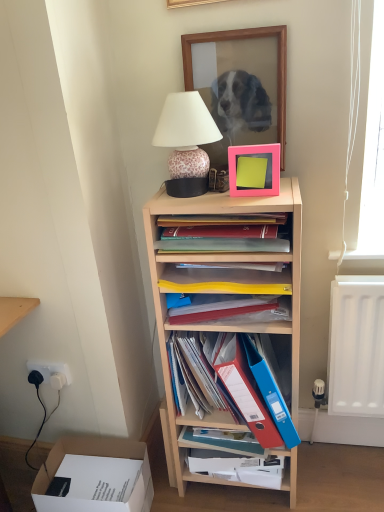
What do you see at coordinates (230, 309) in the screenshot? The width and height of the screenshot is (384, 512). I see `yellow plastic folder at center, the 2th book when ordered from top to bottom` at bounding box center [230, 309].

What is the approximate height of wooden picture frame at upper center, the 2th picture frame in the front-to-back sequence?

It is 15.94 inches.

At what (x,y) coordinates should I click in order to perform the action: click on matte plastic books at upper center, the 3th book when ordered from bottom to top. Please return your answer as a coordinate pair (x, y). Image resolution: width=384 pixels, height=512 pixels. Looking at the image, I should click on (224, 234).

You are a GUI agent. You are given a task and a screenshot of the screen. Output one action in this format:
    pyautogui.click(x=<x>, y=<y>)
    Task: Click on the white cardboard box at lower left
    
    Given the screenshot: What is the action you would take?
    pyautogui.click(x=94, y=476)

Find the location of `white plastic electric outlet at lower left`. white plastic electric outlet at lower left is located at coordinates (52, 372).

Where is `yellow plastic folder at center, the 2th book when ordered from top to bottom`? The width and height of the screenshot is (384, 512). yellow plastic folder at center, the 2th book when ordered from top to bottom is located at coordinates (230, 309).

From the image's perspective, is wooden picture frame at upper center, the 2th picture frame in the front-to-back sequence, below matte pink picture frame at upper center, acting as the 1th picture frame starting from the bottom?

No, from the image's perspective, wooden picture frame at upper center, the 2th picture frame in the front-to-back sequence, is not below matte pink picture frame at upper center, acting as the 1th picture frame starting from the bottom.

Is wooden picture frame at upper center, the 2th picture frame in the bottom-to-top sequence, not near matte pink picture frame at upper center, the first picture frame when ordered from front to back?

That's not correct — wooden picture frame at upper center, the 2th picture frame in the bottom-to-top sequence, is a little close to matte pink picture frame at upper center, the first picture frame when ordered from front to back.

How different are the orientations of wooden picture frame at upper center, the 2th picture frame in the front-to-back sequence, and matte pink picture frame at upper center, the first picture frame when ordered from front to back, in degrees?

2.08 degrees.

Considering the sizes of wooden picture frame at upper center, the 2th picture frame in the front-to-back sequence, and matte pink picture frame at upper center, the first picture frame when ordered from front to back, in the image, is wooden picture frame at upper center, the 2th picture frame in the front-to-back sequence, wider or thinner than matte pink picture frame at upper center, the first picture frame when ordered from front to back,?

In the image, wooden picture frame at upper center, the 2th picture frame in the front-to-back sequence, appears to be more narrow than matte pink picture frame at upper center, the first picture frame when ordered from front to back.

Is wooden picture frame at upper center, the first picture frame when ordered from top to bottom, inside the boundaries of blue plastic folder at center, the first book positioned from the bottom, or outside?

wooden picture frame at upper center, the first picture frame when ordered from top to bottom, is located beyond the bounds of blue plastic folder at center, the first book positioned from the bottom.

Considering the sizes of objects wooden picture frame at upper center, the 2th picture frame in the front-to-back sequence, and blue plastic folder at center, the third book in the top-to-bottom sequence, in the image provided, who is thinner, wooden picture frame at upper center, the 2th picture frame in the front-to-back sequence, or blue plastic folder at center, the third book in the top-to-bottom sequence,?

Thinner between the two is wooden picture frame at upper center, the 2th picture frame in the front-to-back sequence.

Based on their positions, is wooden picture frame at upper center, the 2th picture frame in the bottom-to-top sequence, located to the left or right of blue plastic folder at center, the third book in the top-to-bottom sequence?

wooden picture frame at upper center, the 2th picture frame in the bottom-to-top sequence, is positioned on blue plastic folder at center, the third book in the top-to-bottom sequence,'s right side.

Is matte plastic books at upper center, the 3th book when ordered from bottom to top, smaller than yellow plastic folder at center, the 2th book when ordered from top to bottom?

Actually, matte plastic books at upper center, the 3th book when ordered from bottom to top, might be larger than yellow plastic folder at center, the 2th book when ordered from top to bottom.

From the image's perspective, is matte plastic books at upper center, the 3th book when ordered from bottom to top, positioned above or below yellow plastic folder at center, the 2th book when ordered from top to bottom?

From the image's perspective, matte plastic books at upper center, the 3th book when ordered from bottom to top, appears above yellow plastic folder at center, the 2th book when ordered from top to bottom.

Considering the relative sizes of matte plastic books at upper center, the first book positioned from the top, and yellow plastic folder at center, the 2th book when ordered from top to bottom, in the image provided, is matte plastic books at upper center, the first book positioned from the top, shorter than yellow plastic folder at center, the 2th book when ordered from top to bottom,?

Incorrect, the height of matte plastic books at upper center, the first book positioned from the top, does not fall short of that of yellow plastic folder at center, the 2th book when ordered from top to bottom.

Would you say matte plastic books at upper center, the first book positioned from the top, contains yellow plastic folder at center, acting as the second book starting from the bottom?

Definitely not — yellow plastic folder at center, acting as the second book starting from the bottom, is not inside matte plastic books at upper center, the first book positioned from the top.

Considering the sizes of objects white cardboard box at lower left and blue plastic folder at center, the first book positioned from the bottom, in the image provided, who is wider, white cardboard box at lower left or blue plastic folder at center, the first book positioned from the bottom,?

Wider between the two is white cardboard box at lower left.

Considering the sizes of white cardboard box at lower left and blue plastic folder at center, the third book in the top-to-bottom sequence, in the image, is white cardboard box at lower left taller or shorter than blue plastic folder at center, the third book in the top-to-bottom sequence,?

Considering their sizes, white cardboard box at lower left has less height than blue plastic folder at center, the third book in the top-to-bottom sequence.

From a real-world perspective, which object rests below the other?

white cardboard box at lower left, from a real-world perspective.

Considering the relative sizes of white cardboard box at lower left and blue plastic folder at center, the third book in the top-to-bottom sequence, in the image provided, is white cardboard box at lower left bigger than blue plastic folder at center, the third book in the top-to-bottom sequence,?

Yes, white cardboard box at lower left is bigger than blue plastic folder at center, the third book in the top-to-bottom sequence.

From a real-world perspective, is yellow plastic folder at center, the 2th book when ordered from top to bottom, physically located above or below blue plastic folder at center, the first book positioned from the bottom?

In terms of real-world spatial position, yellow plastic folder at center, the 2th book when ordered from top to bottom, is above blue plastic folder at center, the first book positioned from the bottom.

In terms of height, does yellow plastic folder at center, the 2th book when ordered from top to bottom, look taller or shorter compared to blue plastic folder at center, the third book in the top-to-bottom sequence?

In the image, yellow plastic folder at center, the 2th book when ordered from top to bottom, appears to be shorter than blue plastic folder at center, the third book in the top-to-bottom sequence.

From the image's perspective, between yellow plastic folder at center, the 2th book when ordered from top to bottom, and blue plastic folder at center, the third book in the top-to-bottom sequence, which one is located above?

From the image's view, yellow plastic folder at center, the 2th book when ordered from top to bottom, is above.

Looking at this image, which object is wider, yellow plastic folder at center, the 2th book when ordered from top to bottom, or blue plastic folder at center, the third book in the top-to-bottom sequence?

Wider between the two is yellow plastic folder at center, the 2th book when ordered from top to bottom.

How much distance is there between matte pink picture frame at upper center, the 2th picture frame when ordered from top to bottom, and wooden picture frame at upper center, the first picture frame when ordered from top to bottom?

matte pink picture frame at upper center, the 2th picture frame when ordered from top to bottom, and wooden picture frame at upper center, the first picture frame when ordered from top to bottom, are 10.36 inches apart from each other.

Is wooden picture frame at upper center, the 2th picture frame in the front-to-back sequence, a part of matte pink picture frame at upper center, the 2th picture frame when ordered from top to bottom?

No, wooden picture frame at upper center, the 2th picture frame in the front-to-back sequence, is not surrounded by matte pink picture frame at upper center, the 2th picture frame when ordered from top to bottom.

Locate an element on the screen. This screenshot has width=384, height=512. picture frame above the matte pink picture frame at upper center, the first picture frame when ordered from front to back (from the image's perspective) is located at coordinates (242, 39).

Considering the sizes of objects matte pink picture frame at upper center, acting as the 1th picture frame starting from the bottom, and wooden picture frame at upper center, the 2th picture frame in the front-to-back sequence, in the image provided, who is smaller, matte pink picture frame at upper center, acting as the 1th picture frame starting from the bottom, or wooden picture frame at upper center, the 2th picture frame in the front-to-back sequence,?

With smaller size is matte pink picture frame at upper center, acting as the 1th picture frame starting from the bottom.

From the picture: Do you think leopard print ceramic lamp at upper center is within white cardboard box at lower left, or outside of it?

leopard print ceramic lamp at upper center is not inside white cardboard box at lower left, it's outside.

Considering the positions of objects leopard print ceramic lamp at upper center and white cardboard box at lower left in the image provided, who is more to the left, leopard print ceramic lamp at upper center or white cardboard box at lower left?

white cardboard box at lower left is more to the left.

From the picture: Which of these two, leopard print ceramic lamp at upper center or white cardboard box at lower left, stands shorter?

With less height is white cardboard box at lower left.

This screenshot has width=384, height=512. Identify the location of picture frame that appears behind the matte pink picture frame at upper center, the 2th picture frame when ordered from top to bottom. (242, 39).

This screenshot has width=384, height=512. I want to click on picture frame that is the 1st object to the right of the blue plastic folder at center, the first book positioned from the bottom, starting at the anchor, so click(x=242, y=39).

Considering their positions, is light wood shelf at center positioned closer to matte plastic books at upper center, the first book positioned from the top, than wooden picture frame at upper center, the 2th picture frame in the front-to-back sequence?

light wood shelf at center.

Based on their spatial positions, is matte pink picture frame at upper center, acting as the 1th picture frame starting from the bottom, or white cardboard box at lower left further from white plastic electric outlet at lower left?

matte pink picture frame at upper center, acting as the 1th picture frame starting from the bottom.

Considering their positions, is leopard print ceramic lamp at upper center positioned closer to wooden picture frame at upper center, the first picture frame when ordered from top to bottom, than white plastic electric outlet at lower left?

leopard print ceramic lamp at upper center is closer to wooden picture frame at upper center, the first picture frame when ordered from top to bottom.

Looking at the image, which one is located further to matte plastic books at upper center, the first book positioned from the top, wooden picture frame at upper center, which appears as the first picture frame when viewed from the back, or blue plastic folder at center?

The object further to matte plastic books at upper center, the first book positioned from the top, is wooden picture frame at upper center, which appears as the first picture frame when viewed from the back.

Looking at the image, which one is located closer to blue plastic folder at center, the first book positioned from the bottom, light wood shelf at center or white cardboard box at lower left?

light wood shelf at center.

When comparing their distances from leopard print ceramic lamp at upper center, does yellow plastic folder at center, acting as the second book starting from the bottom, or matte plastic books at upper center, the first book positioned from the top, seem closer?

Based on the image, matte plastic books at upper center, the first book positioned from the top, appears to be nearer to leopard print ceramic lamp at upper center.

Based on the photo, looking at the image, which one is located closer to leopard print ceramic lamp at upper center, white plastic electric outlet at lower left or light wood shelf at center?

The object closer to leopard print ceramic lamp at upper center is light wood shelf at center.

Considering their positions, is leopard print ceramic lamp at upper center positioned further to white cardboard box at lower left than light wood shelf at center?

Based on the image, leopard print ceramic lamp at upper center appears to be further to white cardboard box at lower left.

Locate an element on the screen. shelf situated between white plastic electric outlet at lower left and matte pink picture frame at upper center, acting as the 1th picture frame starting from the bottom, from left to right is located at coordinates (216, 287).

I want to click on shelf between yellow plastic folder at center, the 2th book when ordered from top to bottom, and blue plastic folder at center in the up-down direction, so click(x=216, y=287).

Find the location of a particular element. This screenshot has height=512, width=384. book between wooden picture frame at upper center, the first picture frame when ordered from top to bottom, and yellow plastic folder at center, the 2th book when ordered from top to bottom, in the up-down direction is located at coordinates (224, 234).

Identify the location of paperback book between matte plastic books at upper center, the first book positioned from the top, and white cardboard box at lower left in the up-down direction. Image resolution: width=384 pixels, height=512 pixels. (271, 385).